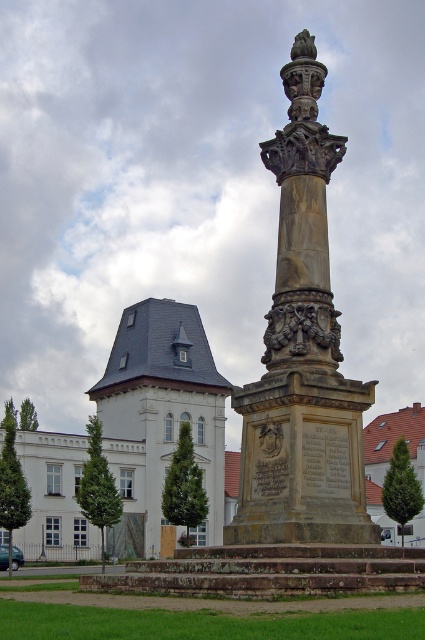
Question: Considering the relative positions of carved stone column at center and white stone building at left in the image provided, where is carved stone column at center located with respect to white stone building at left?

Choices:
 (A) below
 (B) above

Answer: (B)

Question: Is carved stone column at center closer to the viewer compared to white stone building at left?

Choices:
 (A) yes
 (B) no

Answer: (A)

Question: Which object is closer to the camera taking this photo?

Choices:
 (A) carved stone column at center
 (B) white stone building at left

Answer: (A)

Question: Can you confirm if carved stone column at center is positioned to the right of white stone building at left?

Choices:
 (A) no
 (B) yes

Answer: (B)